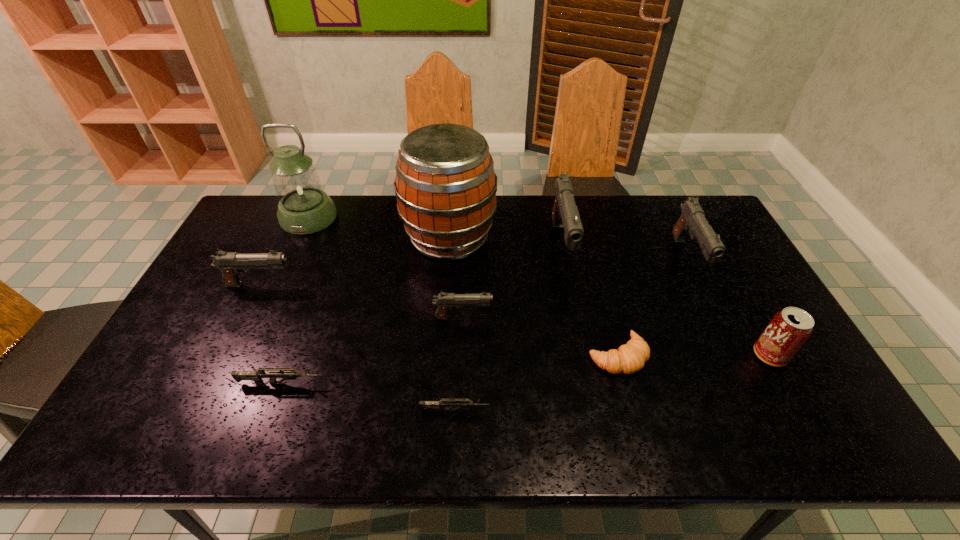
You are a GUI agent. You are given a task and a screenshot of the screen. Output one action in this format:
    pyautogui.click(x=<x>, y=<y>)
    Task: Click on the sixth farthest object
    The height and width of the screenshot is (540, 960).
    Given the screenshot: What is the action you would take?
    pyautogui.click(x=445, y=301)

Where is `the third gray gun from right to left`? The width and height of the screenshot is (960, 540). the third gray gun from right to left is located at coordinates (445, 301).

The width and height of the screenshot is (960, 540). In order to click on the left grey gun in this screenshot , I will do `click(256, 376)`.

The width and height of the screenshot is (960, 540). In order to click on the bigger grey gun in this screenshot , I will do `click(256, 376)`.

At what (x,y) coordinates should I click in order to perform the action: click on crescent roll. Please return your answer as a coordinate pair (x, y). The width and height of the screenshot is (960, 540). Looking at the image, I should click on (629, 358).

Locate an element on the screen. the nearest gun is located at coordinates (460, 403).

This screenshot has width=960, height=540. I want to click on the nearer grey gun, so pos(460,403).

In order to click on free spot located on the right of the cider in this screenshot , I will do `click(511, 237)`.

Locate an element on the screen. vacant space located on the left of the greenish lantern is located at coordinates (258, 217).

This screenshot has height=540, width=960. Find the location of `free location located 0.320m in the direction the second gray gun from right to left is aimed`. free location located 0.320m in the direction the second gray gun from right to left is aimed is located at coordinates [587, 367].